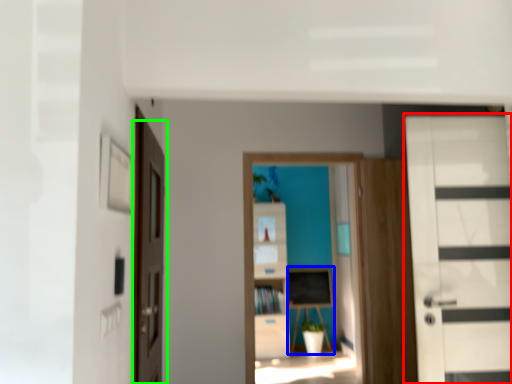
Question: Considering the real-world distances, which object is closest to door (highlighted by a red box)? table (highlighted by a blue box) or door (highlighted by a green box).

Choices:
 (A) table
 (B) door

Answer: (B)